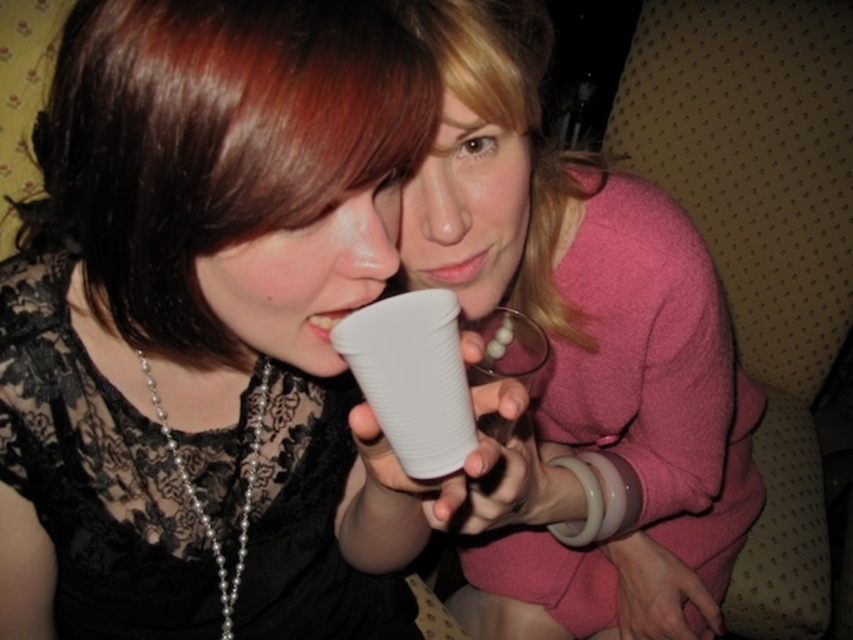
You are a photographer taking a picture of the two people in the scene. You want to ensure that both the pink matte sweater at upper right and the blondehair at upper center are fully visible in the frame. Given their positions, which object should you focus on to avoid cropping either of them?

The pink matte sweater at upper right is taller than blondehair at upper center, so you should focus on the pink matte sweater at upper right to ensure both are fully visible as it requires more vertical space.

You are a photographer trying to capture a candid shot of the two people in the scene. You want to ensure that both the pink matte sweater at upper right and the blondehair at upper center are clearly visible in the frame. Given their current positions, do you think you can fit both into the shot without moving the subjects?

The pink matte sweater at upper right and the blondehair at upper center are 4.81 inches apart, so yes, you can fit both into the shot as they are relatively close to each other and within a manageable distance for a candid photograph.